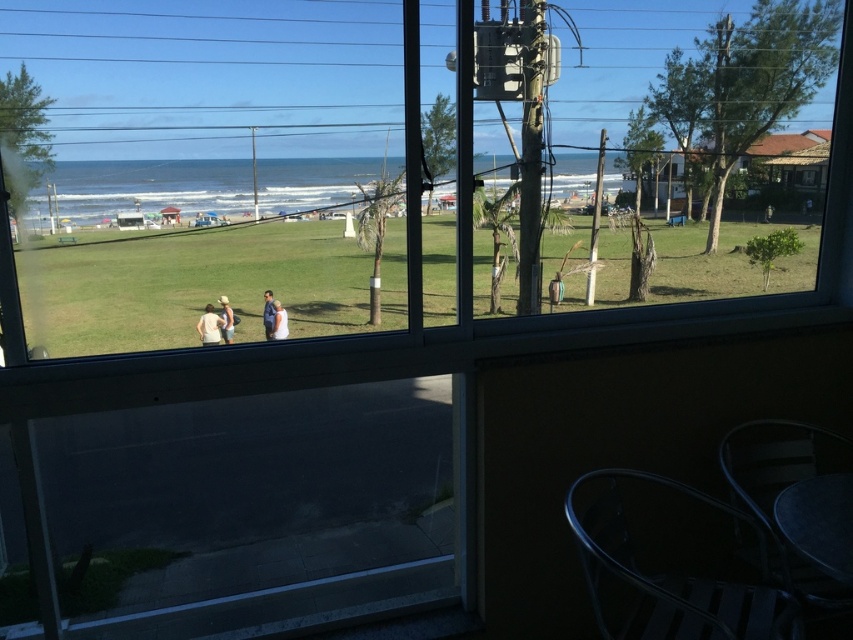
Question: Which point is farther from the camera taking this photo?

Choices:
 (A) (270, 292)
 (B) (265, 289)
 (C) (228, 304)

Answer: (B)

Question: Can you confirm if green grassy field at center is positioned to the left of white fabric dress at center?

Choices:
 (A) yes
 (B) no

Answer: (B)

Question: Can you confirm if green grassy field at center is positioned to the left of matte white shirt at center?

Choices:
 (A) no
 (B) yes

Answer: (A)

Question: Is white cotton shirt at center wider than white fabric dress at center?

Choices:
 (A) yes
 (B) no

Answer: (A)

Question: Among these objects, which one is farthest from the camera?

Choices:
 (A) white cotton shirt at center
 (B) green grassy field at center
 (C) blue fabric jacket at center
 (D) light brown fabric shirt at center

Answer: (C)

Question: Among these objects, which one is farthest from the camera?

Choices:
 (A) green grassy field at center
 (B) blue fabric jacket at center
 (C) light brown fabric shirt at center
 (D) white fabric dress at center

Answer: (D)